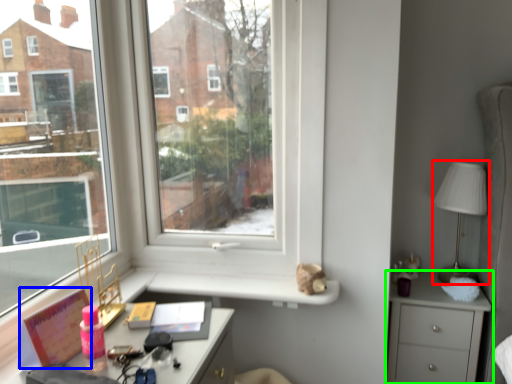
Question: Which object is the closest to the table lamp (highlighted by a red box)? Choose among these: book (highlighted by a blue box) or chest of drawers (highlighted by a green box).

Choices:
 (A) book
 (B) chest of drawers

Answer: (B)